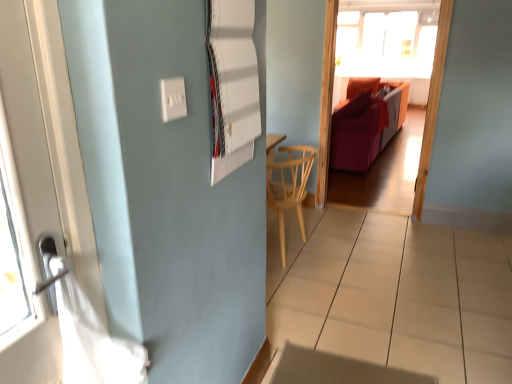
Question: Is light wood chair at center directly adjacent to white paperboard at upper center?

Choices:
 (A) yes
 (B) no

Answer: (B)

Question: Can you confirm if light wood chair at center is bigger than white paperboard at upper center?

Choices:
 (A) no
 (B) yes

Answer: (B)

Question: Are light wood chair at center and white paperboard at upper center located far from each other?

Choices:
 (A) yes
 (B) no

Answer: (A)

Question: From a real-world perspective, is light wood chair at center below white paperboard at upper center?

Choices:
 (A) no
 (B) yes

Answer: (B)

Question: Is light wood chair at center smaller than white paperboard at upper center?

Choices:
 (A) yes
 (B) no

Answer: (B)

Question: Relative to white paperboard at upper center, is velvet red sofa at center in front or behind?

Choices:
 (A) front
 (B) behind

Answer: (B)

Question: Is point (391, 117) positioned closer to the camera than point (244, 104)?

Choices:
 (A) closer
 (B) farther

Answer: (B)

Question: From the image's perspective, is velvet red sofa at center positioned above or below white paperboard at upper center?

Choices:
 (A) above
 (B) below

Answer: (A)

Question: Do you think velvet red sofa at center is within white paperboard at upper center, or outside of it?

Choices:
 (A) inside
 (B) outside

Answer: (B)

Question: Based on their sizes in the image, would you say velvet red sofa at center is bigger or smaller than velvet orange couch at center?

Choices:
 (A) big
 (B) small

Answer: (A)

Question: From the image's perspective, is velvet red sofa at center positioned above or below velvet orange couch at center?

Choices:
 (A) below
 (B) above

Answer: (B)

Question: Is velvet red sofa at center inside the boundaries of velvet orange couch at center, or outside?

Choices:
 (A) inside
 (B) outside

Answer: (B)

Question: Considering their positions, is velvet red sofa at center located in front of or behind velvet orange couch at center?

Choices:
 (A) behind
 (B) front

Answer: (A)

Question: Is point (493, 299) positioned closer to the camera than point (332, 61)?

Choices:
 (A) farther
 (B) closer

Answer: (B)

Question: Is white glossy tile at lower center to the left or to the right of velvet orange couch at center in the image?

Choices:
 (A) right
 (B) left

Answer: (B)